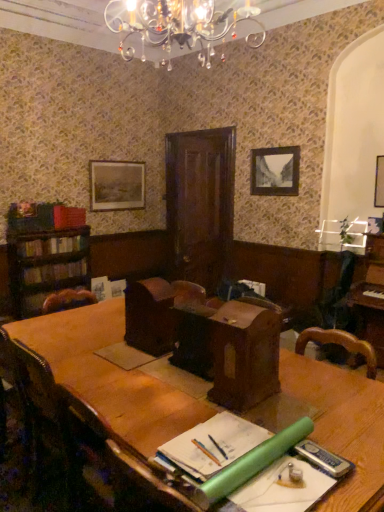
Locate an element on the screen. This screenshot has height=512, width=384. vacant space in front of brown leather armchair at center, which is the 2th armchair in left-to-right order is located at coordinates (188, 386).